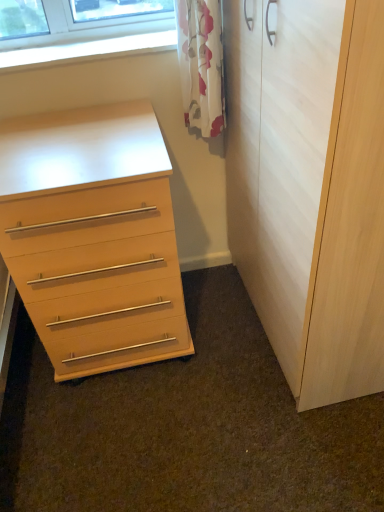
Locate an element on the screen. The height and width of the screenshot is (512, 384). free location in front of light wood/texture cupboard at right is located at coordinates (284, 448).